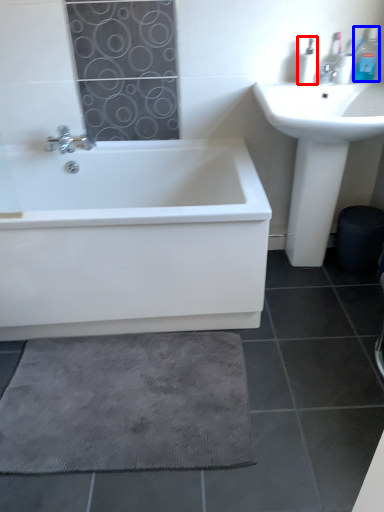
Question: Which point is closer to the camera, toiletry (highlighted by a red box) or toiletry (highlighted by a blue box)?

Choices:
 (A) toiletry
 (B) toiletry

Answer: (B)